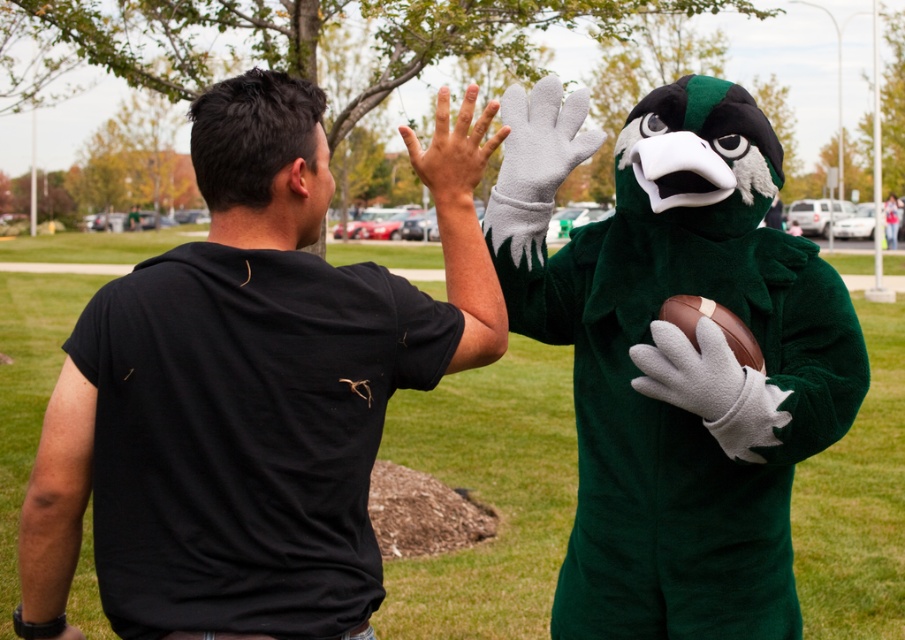
You are a GUI agent. You are given a task and a screenshot of the screen. Output one action in this format:
    pyautogui.click(x=<x>, y=<y>)
    Task: Click on the gray fleece glove at lower center
    The width and height of the screenshot is (905, 640).
    Given the screenshot: What is the action you would take?
    pyautogui.click(x=689, y=369)

Which is more to the right, gray fleece glove at lower center or smooth skin hand at center?

Positioned to the right is gray fleece glove at lower center.

Is point (698, 371) less distant than point (455, 129)?

No, it is not.

Where is `gray fleece glove at lower center`? Image resolution: width=905 pixels, height=640 pixels. gray fleece glove at lower center is located at coordinates (689, 369).

Can you confirm if black matte t-shirt at upper left is positioned to the right of gray fleece glove at lower center?

In fact, black matte t-shirt at upper left is to the left of gray fleece glove at lower center.

Locate an element on the screen. This screenshot has width=905, height=640. black matte t-shirt at upper left is located at coordinates (249, 394).

Which is below, black matte t-shirt at upper left or white fleece glove at center?

black matte t-shirt at upper left

Does black matte t-shirt at upper left appear on the left side of white fleece glove at center?

Correct, you'll find black matte t-shirt at upper left to the left of white fleece glove at center.

This screenshot has width=905, height=640. In order to click on black matte t-shirt at upper left in this screenshot , I will do `click(249, 394)`.